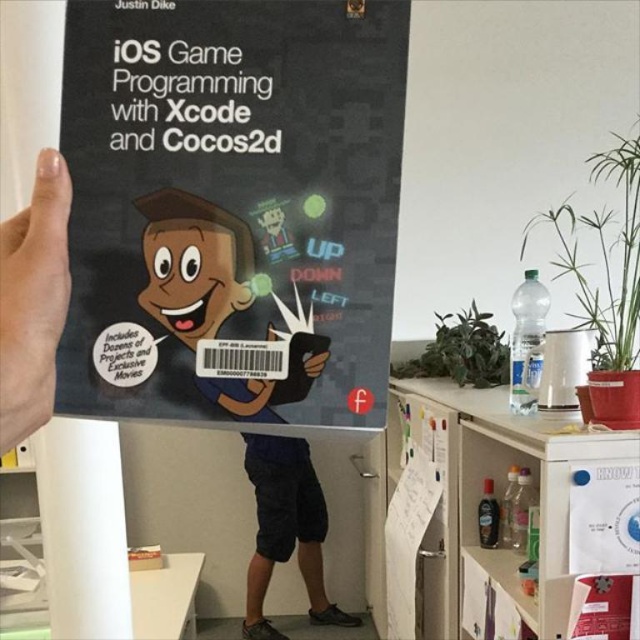
In the scene shown: Who is lower down, smooth skin hand at upper left or dark blue cotton shorts at lower center?

dark blue cotton shorts at lower center

The width and height of the screenshot is (640, 640). What do you see at coordinates (33, 300) in the screenshot?
I see `smooth skin hand at upper left` at bounding box center [33, 300].

The image size is (640, 640). I want to click on smooth skin hand at upper left, so click(x=33, y=300).

Can you confirm if matte brown character at center is bigger than dark blue cotton shorts at lower center?

Actually, matte brown character at center might be smaller than dark blue cotton shorts at lower center.

Does point (198, 304) come closer to viewer compared to point (273, 497)?

Yes.

The height and width of the screenshot is (640, 640). I want to click on matte brown character at center, so click(x=193, y=264).

Which is more to the right, white paper at lower left or dark blue cotton shorts at lower center?

dark blue cotton shorts at lower center

Find the location of `white paper at lower left`. white paper at lower left is located at coordinates (83, 529).

Is point (65, 509) behind point (323, 568)?

No.

The height and width of the screenshot is (640, 640). I want to click on white paper at lower left, so click(83, 529).